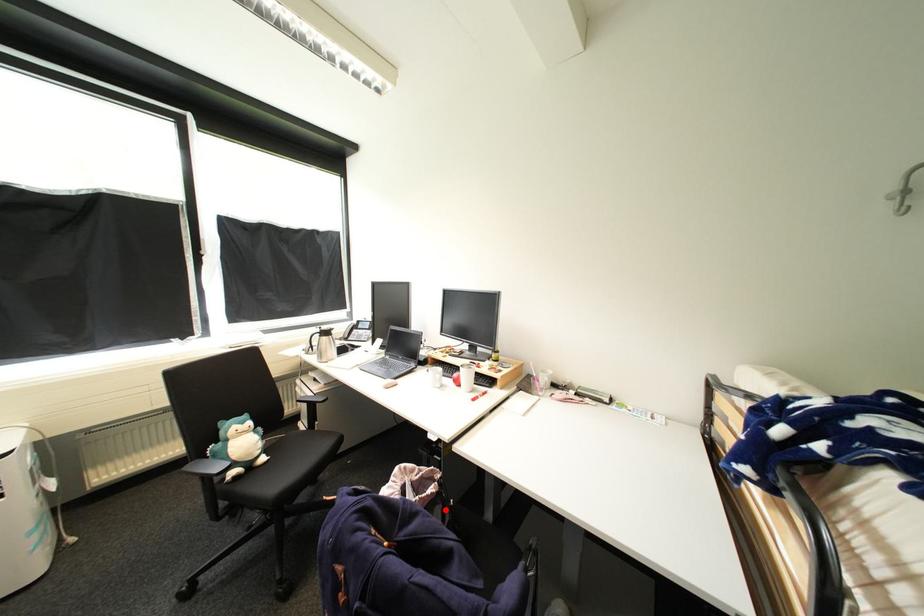
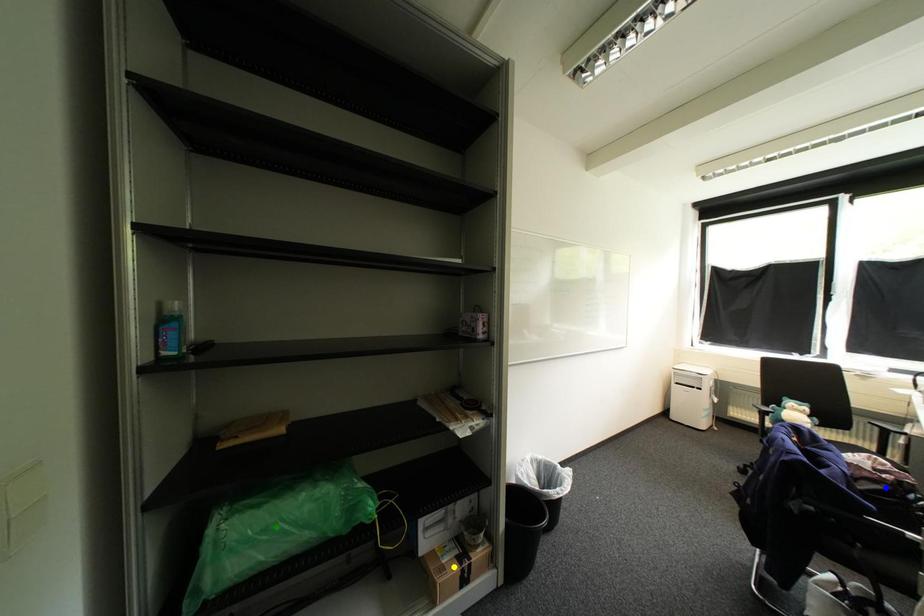
Question: I am providing you with two images of the same scene from different viewpoints. A red point is marked on the first image. You are given multiple points on the second image. Can you choose the point in image 2 that corresponds to the point in image 1?

Choices:
 (A) green point
 (B) yellow point
 (C) blue point

Answer: (C)